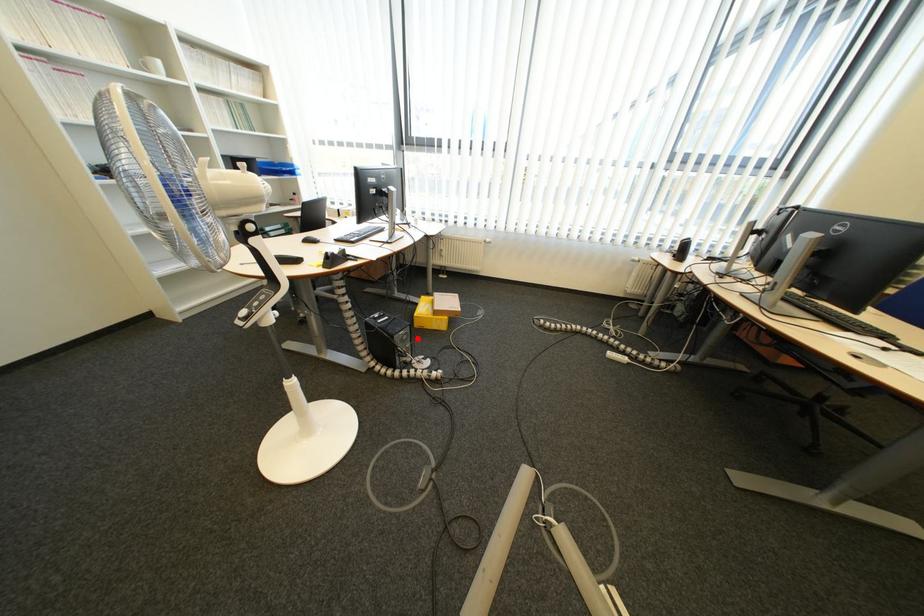
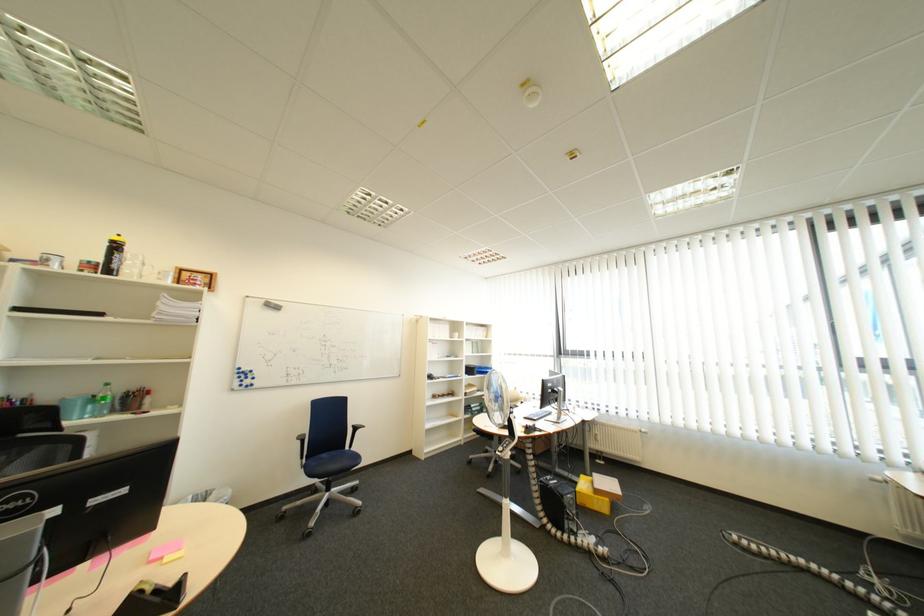
Where in the second image is the point corresponding to the highlighted location from the first image?

(585, 503)